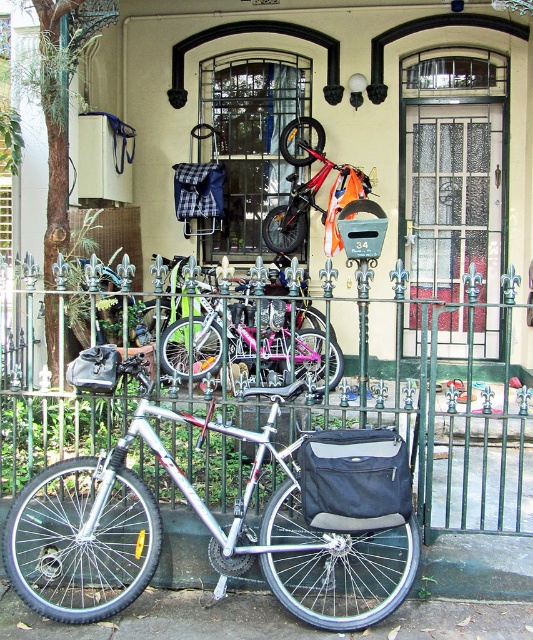
Is point (297, 365) positioned before point (330, 241)?

Yes, point (297, 365) is closer to viewer.

Does pink metallic bicycle at center have a lesser width compared to orange matte bicycle at center?

Incorrect, pink metallic bicycle at center's width is not less than orange matte bicycle at center's.

Is point (172, 337) closer to viewer compared to point (311, 180)?

Yes, it is in front of point (311, 180).

This screenshot has width=533, height=640. What are the coordinates of `pink metallic bicycle at center` in the screenshot? It's located at (254, 339).

Does green wrought iron fence at center have a larger size compared to silver metallic bicycle at center?

Correct, green wrought iron fence at center is larger in size than silver metallic bicycle at center.

Which is below, green wrought iron fence at center or silver metallic bicycle at center?

Positioned lower is silver metallic bicycle at center.

Does point (196, 289) come closer to viewer compared to point (327, 493)?

No, it is not.

Where is `green wrought iron fence at center`? green wrought iron fence at center is located at coordinates 278,381.

Is green wrought iron fence at center positioned behind pink metallic bicycle at center?

No, it is in front of pink metallic bicycle at center.

Does green wrought iron fence at center have a smaller size compared to pink metallic bicycle at center?

Incorrect, green wrought iron fence at center is not smaller in size than pink metallic bicycle at center.

Who is more forward, (461, 476) or (245, 285)?

Point (461, 476)

The image size is (533, 640). Identify the location of green wrought iron fence at center. (278, 381).